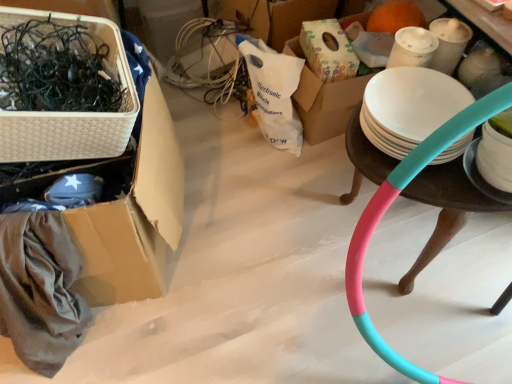
Where is `vacant position to the left of white matte plate at right`? The image size is (512, 384). vacant position to the left of white matte plate at right is located at coordinates (437, 180).